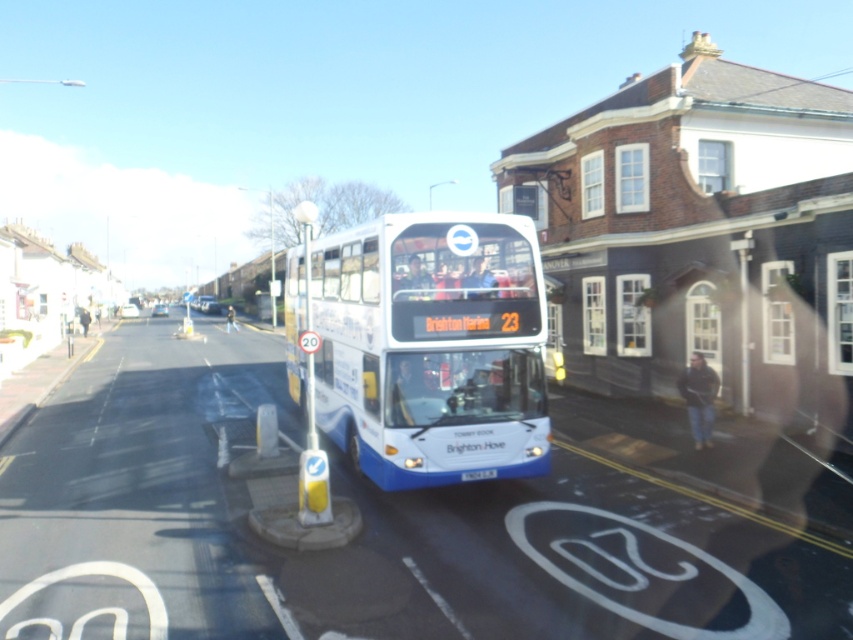
Question: Is white glossy bus at center positioned before white plastic license plate at center?

Choices:
 (A) no
 (B) yes

Answer: (B)

Question: Can you confirm if white glossy bus at center is positioned to the left of white plastic license plate at center?

Choices:
 (A) yes
 (B) no

Answer: (A)

Question: Is white glossy bus at center closer to the viewer compared to white plastic license plate at center?

Choices:
 (A) yes
 (B) no

Answer: (A)

Question: Which point is closer to the camera?

Choices:
 (A) (440, 445)
 (B) (486, 474)

Answer: (A)

Question: Among these points, which one is nearest to the camera?

Choices:
 (A) (381, 412)
 (B) (483, 476)

Answer: (A)